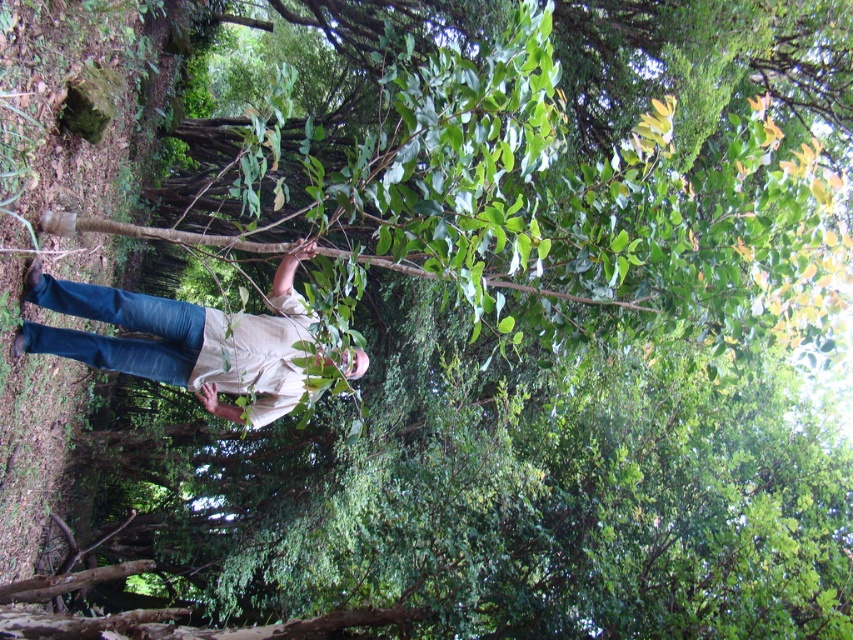
You are a hiker who just arrived at the scene. You need to place a 2m tall tent pole between the denim jeans at lower left and the brown rough tree branch at center. Can you fit the tent pole vertically between them?

The denim jeans at lower left is much taller than the brown rough tree branch at center. Since the tent pole is 2m tall, it cannot be placed vertically between them because the space between the two objects is smaller than the pole height.

You are a hiker who has just arrived at this forest area. You notice your dark blue jeans are at lower left at point (x=183, y=339). You want to pick them up. Which direction should you move to reach them?

The denim jeans at lower left are located at point (x=183, y=339), so you should move to your lower left direction to reach them.